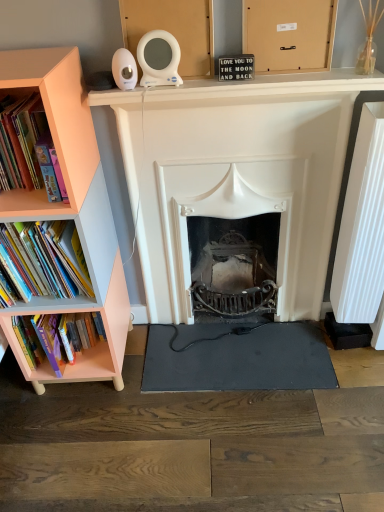
At what (x,y) coordinates should I click in order to perform the action: click on free space in front of peach wood bookcase at left. Please return your answer as a coordinate pair (x, y). This screenshot has height=512, width=384. Looking at the image, I should click on (73, 436).